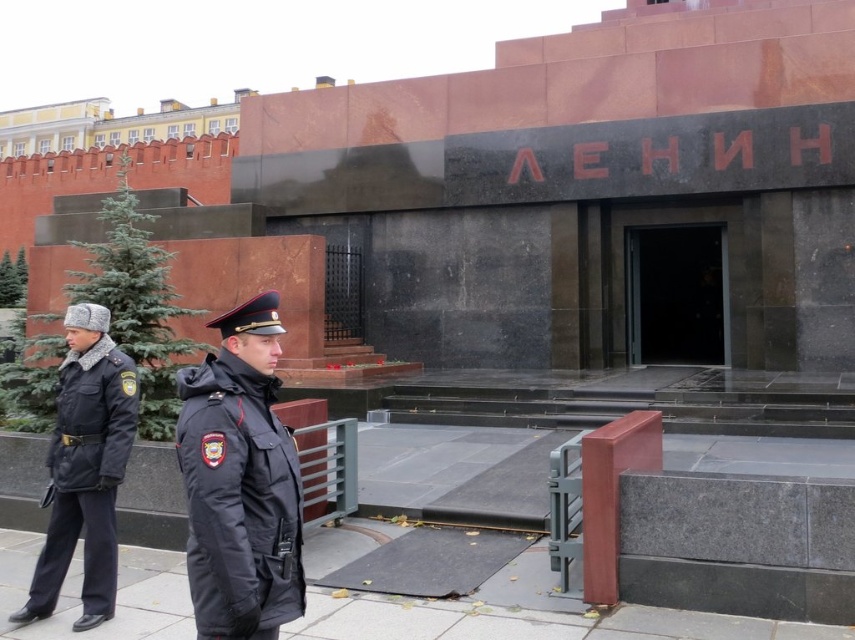
You are a visitor approaching the entrance of the building. You see the black matte uniform at left and the black glass door at center. Which object is closer to you as you approach the entrance?

The black matte uniform at left is closer to you because it is in front of the black glass door at center.

You are a visitor approaching the building and see the dark blue fabric uniform at left and the black glass door at center. Which object is closer to the ground?

The dark blue fabric uniform at left is located below the black glass door at center, so it is closer to the ground.

You are a visitor approaching the building and see the dark blue fabric uniform at left and the black glass door at center. Which object appears shorter from your perspective?

The dark blue fabric uniform at left appears shorter than the black glass door at center from your perspective.